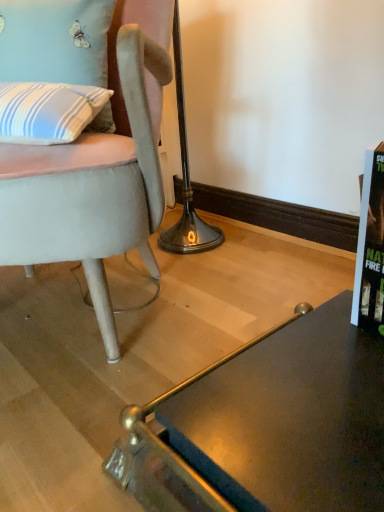
What do you see at coordinates (96, 170) in the screenshot? I see `suede-like gray chair at left` at bounding box center [96, 170].

What do you see at coordinates (55, 41) in the screenshot? I see `blue striped fabric pillow at upper left` at bounding box center [55, 41].

Find the location of a particular element. The height and width of the screenshot is (512, 384). blue striped fabric pillow at upper left is located at coordinates click(x=55, y=41).

This screenshot has height=512, width=384. Describe the element at coordinates (269, 425) in the screenshot. I see `glassy dark brown desk at lower right` at that location.

What are the coordinates of `suede-like gray chair at left` in the screenshot? It's located at (96, 170).

From the image's perspective, is blue striped fabric pillow at upper left above suede-like gray chair at left?

Yes, from the image's perspective, blue striped fabric pillow at upper left is on top of suede-like gray chair at left.

Is blue striped fabric pillow at upper left looking in the opposite direction of suede-like gray chair at left?

Yes, blue striped fabric pillow at upper left is positioned with its back facing suede-like gray chair at left.

Can you confirm if blue striped fabric pillow at upper left is smaller than suede-like gray chair at left?

Yes, blue striped fabric pillow at upper left is smaller than suede-like gray chair at left.

From a real-world perspective, between blue striped fabric pillow at upper left and suede-like gray chair at left, who is vertically lower?

In real-world perspective, suede-like gray chair at left is lower.

Which is correct: suede-like gray chair at left is inside blue striped fabric pillow at upper left, or outside of it?

suede-like gray chair at left is located beyond the bounds of blue striped fabric pillow at upper left.

Are suede-like gray chair at left and blue striped fabric pillow at upper left located far from each other?

suede-like gray chair at left is actually quite close to blue striped fabric pillow at upper left.

How far apart are suede-like gray chair at left and blue striped fabric pillow at upper left?

7.50 inches.

Does suede-like gray chair at left come behind blue striped fabric pillow at upper left?

No, the depth of suede-like gray chair at left is less than that of blue striped fabric pillow at upper left.

Is suede-like gray chair at left completely or partially outside of glassy dark brown desk at lower right?

Absolutely, suede-like gray chair at left is external to glassy dark brown desk at lower right.

Considering the relative sizes of suede-like gray chair at left and glassy dark brown desk at lower right in the image provided, is suede-like gray chair at left shorter than glassy dark brown desk at lower right?

Incorrect, the height of suede-like gray chair at left does not fall short of that of glassy dark brown desk at lower right.

Does suede-like gray chair at left have a smaller size compared to glassy dark brown desk at lower right?

No, suede-like gray chair at left is not smaller than glassy dark brown desk at lower right.

Which of these two, suede-like gray chair at left or glassy dark brown desk at lower right, is wider?

With larger width is glassy dark brown desk at lower right.

From the image's perspective, which object appears higher, glassy dark brown desk at lower right or suede-like gray chair at left?

suede-like gray chair at left, from the image's perspective.

Based on their positions, is glassy dark brown desk at lower right located to the left or right of suede-like gray chair at left?

Based on their positions, glassy dark brown desk at lower right is located to the right of suede-like gray chair at left.

From a real-world perspective, between glassy dark brown desk at lower right and suede-like gray chair at left, who is vertically lower?

From a 3D spatial view, glassy dark brown desk at lower right is below.

Is glassy dark brown desk at lower right not near suede-like gray chair at left?

glassy dark brown desk at lower right is actually quite close to suede-like gray chair at left.

From a real-world perspective, which is physically below, glassy dark brown desk at lower right or blue striped fabric pillow at upper left?

From a 3D spatial view, glassy dark brown desk at lower right is below.

Could you tell me if glassy dark brown desk at lower right is facing blue striped fabric pillow at upper left?

No.

Considering the points (250, 473) and (58, 81), which point is behind, point (250, 473) or point (58, 81)?

The point (58, 81) is farther from the camera.

Where is `pillow that is above the glassy dark brown desk at lower right (from the image's perspective)`? pillow that is above the glassy dark brown desk at lower right (from the image's perspective) is located at coordinates (55, 41).

Which object is further away from the camera, blue striped fabric pillow at upper left or glassy dark brown desk at lower right?

blue striped fabric pillow at upper left is further away from the camera.

Which of these two, blue striped fabric pillow at upper left or glassy dark brown desk at lower right, is bigger?

glassy dark brown desk at lower right.

Is blue striped fabric pillow at upper left turned away from glassy dark brown desk at lower right?

No, blue striped fabric pillow at upper left is not facing the opposite direction of glassy dark brown desk at lower right.

In terms of height, does blue striped fabric pillow at upper left look taller or shorter compared to glassy dark brown desk at lower right?

Clearly, blue striped fabric pillow at upper left is taller compared to glassy dark brown desk at lower right.

This screenshot has height=512, width=384. I want to click on pillow that is behind the suede-like gray chair at left, so click(x=55, y=41).

Find the location of `chair lying in front of the blue striped fabric pillow at upper left`. chair lying in front of the blue striped fabric pillow at upper left is located at coordinates (96, 170).

Considering their positions, is blue striped fabric pillow at upper left positioned further to glassy dark brown desk at lower right than suede-like gray chair at left?

blue striped fabric pillow at upper left lies further to glassy dark brown desk at lower right than the other object.

Estimate the real-world distances between objects in this image. Which object is closer to blue striped fabric pillow at upper left, glassy dark brown desk at lower right or suede-like gray chair at left?

suede-like gray chair at left lies closer to blue striped fabric pillow at upper left than the other object.

From the image, which object appears to be nearer to suede-like gray chair at left, glassy dark brown desk at lower right or blue striped fabric pillow at upper left?

blue striped fabric pillow at upper left is positioned closer to the anchor suede-like gray chair at left.

Considering their positions, is blue striped fabric pillow at upper left positioned further to suede-like gray chair at left than glassy dark brown desk at lower right?

Among the two, glassy dark brown desk at lower right is located further to suede-like gray chair at left.

Which object lies nearer to the anchor point glassy dark brown desk at lower right, suede-like gray chair at left or blue striped fabric pillow at upper left?

The object closer to glassy dark brown desk at lower right is suede-like gray chair at left.

When comparing their distances from blue striped fabric pillow at upper left, does suede-like gray chair at left or glassy dark brown desk at lower right seem further?

The object further to blue striped fabric pillow at upper left is glassy dark brown desk at lower right.

I want to click on chair between blue striped fabric pillow at upper left and glassy dark brown desk at lower right from top to bottom, so click(96, 170).